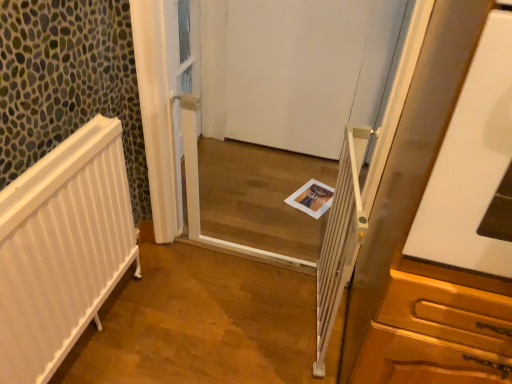
Question: From the image's perspective, is white plastic screen door at center beneath white plastic balustrade at center?

Choices:
 (A) no
 (B) yes

Answer: (A)

Question: Is white plastic screen door at center taller than white plastic balustrade at center?

Choices:
 (A) yes
 (B) no

Answer: (A)

Question: Are white plastic screen door at center and white plastic balustrade at center located far from each other?

Choices:
 (A) no
 (B) yes

Answer: (A)

Question: Is white plastic screen door at center bigger than white plastic balustrade at center?

Choices:
 (A) yes
 (B) no

Answer: (A)

Question: Is white plastic balustrade at center inside white plastic screen door at center?

Choices:
 (A) no
 (B) yes

Answer: (A)

Question: Would you say white plastic screen door at center is outside white plastic balustrade at center?

Choices:
 (A) no
 (B) yes

Answer: (B)

Question: From the image's perspective, is white plastic screen door at center under white paper magazine at center?

Choices:
 (A) no
 (B) yes

Answer: (A)

Question: Does white plastic screen door at center have a smaller size compared to white paper magazine at center?

Choices:
 (A) yes
 (B) no

Answer: (B)

Question: Is white paper magazine at center a part of white plastic screen door at center?

Choices:
 (A) no
 (B) yes

Answer: (A)

Question: Can you see white plastic screen door at center touching white paper magazine at center?

Choices:
 (A) no
 (B) yes

Answer: (A)

Question: Does white plastic screen door at center have a lesser width compared to white paper magazine at center?

Choices:
 (A) yes
 (B) no

Answer: (A)

Question: Is white plastic screen door at center behind white paper magazine at center?

Choices:
 (A) yes
 (B) no

Answer: (B)

Question: Could you tell me if white matte door at center is facing white paper magazine at center?

Choices:
 (A) yes
 (B) no

Answer: (A)